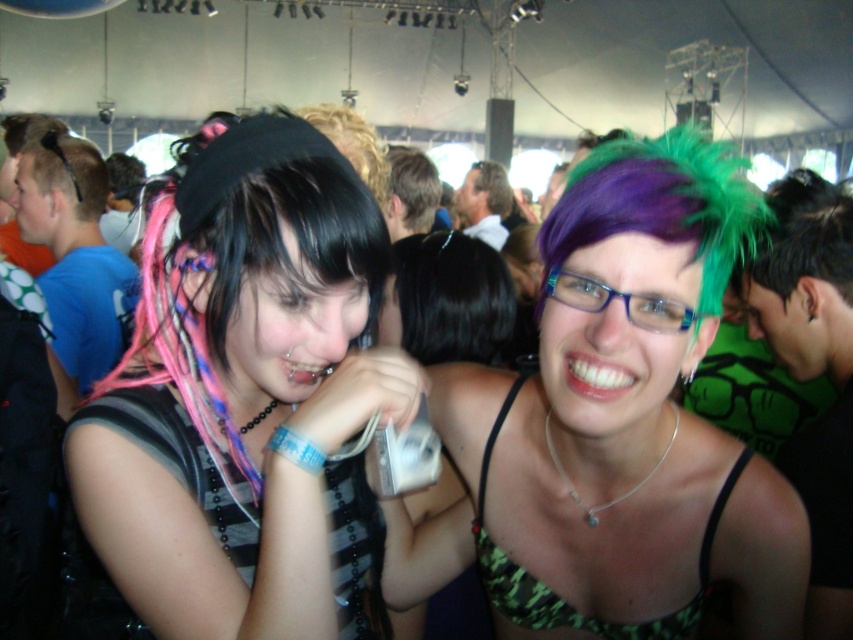
Looking at this image, who is more forward, (660, 401) or (575, 621)?

Point (660, 401) is in front.

Which is behind, point (461, 444) or point (515, 579)?

The point (461, 444) is more distant.

You are a GUI agent. You are given a task and a screenshot of the screen. Output one action in this format:
    pyautogui.click(x=<x>, y=<y>)
    Task: Click on the multicolored hair at center
    
    Given the screenshot: What is the action you would take?
    pyautogui.click(x=625, y=417)

Does matte black hair at center have a larger size compared to multicolored hair at center?

No.

Which of these two, matte black hair at center or multicolored hair at center, stands taller?

matte black hair at center is taller.

Does point (322, 288) come closer to viewer compared to point (660, 536)?

Yes.

Find the location of a particular element. The width and height of the screenshot is (853, 640). matte black hair at center is located at coordinates (248, 400).

The width and height of the screenshot is (853, 640). What are the coordinates of `matte black hair at center` in the screenshot? It's located at (248, 400).

Who is shorter, matte black hair at center or green camouflage bikini top at center?

With less height is green camouflage bikini top at center.

Where is `matte black hair at center`? The height and width of the screenshot is (640, 853). matte black hair at center is located at coordinates (248, 400).